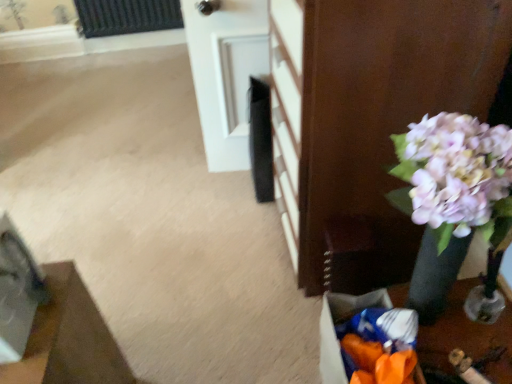
Question: Is there a large distance between wooden floor mat at lower left, which is counted as the second furniture, starting from the top, and white glossy door at upper center?

Choices:
 (A) no
 (B) yes

Answer: (B)

Question: Does wooden floor mat at lower left, which is counted as the second furniture, starting from the top, have a smaller size compared to white glossy door at upper center?

Choices:
 (A) yes
 (B) no

Answer: (A)

Question: Can you confirm if wooden floor mat at lower left, the second furniture in the right-to-left sequence, is wider than white glossy door at upper center?

Choices:
 (A) no
 (B) yes

Answer: (B)

Question: Would you say wooden floor mat at lower left, arranged as the 1th furniture when viewed from the left, is outside white glossy door at upper center?

Choices:
 (A) no
 (B) yes

Answer: (B)

Question: Is wooden floor mat at lower left, which is the first furniture in bottom-to-top order, positioned behind white glossy door at upper center?

Choices:
 (A) yes
 (B) no

Answer: (B)

Question: In the image, is matte black vase at right, marked as the 2th furniture in a left-to-right arrangement, on the left side or the right side of white glossy door at upper center?

Choices:
 (A) right
 (B) left

Answer: (A)

Question: From the image's perspective, is matte black vase at right, which appears as the first furniture when viewed from the right, located above or below white glossy door at upper center?

Choices:
 (A) above
 (B) below

Answer: (B)

Question: In terms of height, does matte black vase at right, which appears as the second furniture when ordered from the bottom, look taller or shorter compared to white glossy door at upper center?

Choices:
 (A) tall
 (B) short

Answer: (A)

Question: From a real-world perspective, is matte black vase at right, which appears as the first furniture when viewed from the right, positioned above or below white glossy door at upper center?

Choices:
 (A) above
 (B) below

Answer: (A)

Question: In the image, is orange plastic bag at lower right positioned in front of or behind wooden floor mat at lower left, which is counted as the second furniture, starting from the top?

Choices:
 (A) front
 (B) behind

Answer: (B)

Question: Is point (424, 332) positioned closer to the camera than point (48, 271)?

Choices:
 (A) farther
 (B) closer

Answer: (A)

Question: Which is correct: orange plastic bag at lower right is inside wooden floor mat at lower left, the second furniture in the right-to-left sequence, or outside of it?

Choices:
 (A) inside
 (B) outside

Answer: (B)

Question: From their relative heights in the image, would you say orange plastic bag at lower right is taller or shorter than wooden floor mat at lower left, the second furniture in the right-to-left sequence?

Choices:
 (A) short
 (B) tall

Answer: (A)

Question: Is point (223, 66) positioned closer to the camera than point (340, 311)?

Choices:
 (A) closer
 (B) farther

Answer: (B)

Question: Is white glossy door at upper center taller or shorter than orange plastic bag at lower right?

Choices:
 (A) short
 (B) tall

Answer: (B)